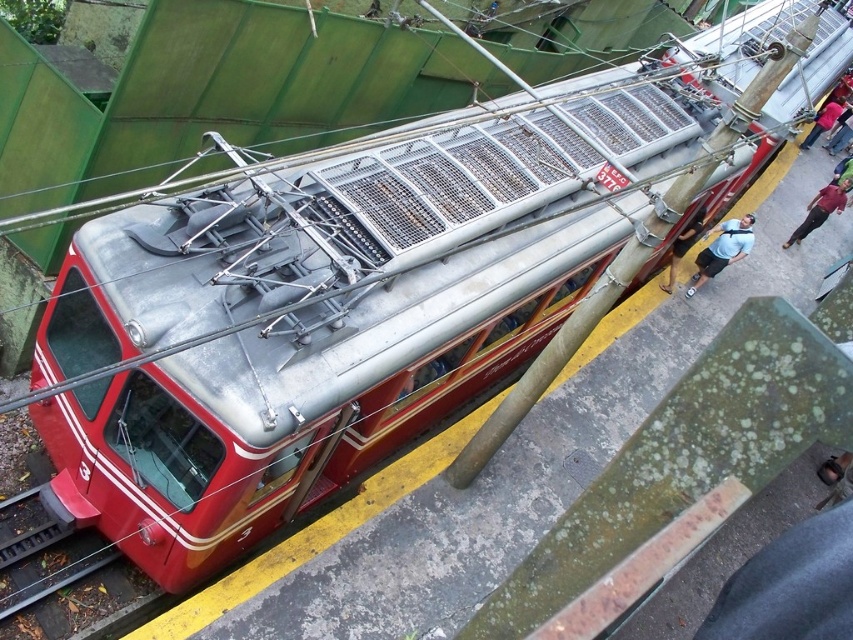
How much distance is there between light blue shirt at center and denim jacket at upper right?

The distance of light blue shirt at center from denim jacket at upper right is 41.24 feet.

Who is taller, light blue shirt at center or denim jacket at upper right?

With more height is denim jacket at upper right.

The height and width of the screenshot is (640, 853). In order to click on light blue shirt at center in this screenshot , I will do `click(722, 250)`.

This screenshot has width=853, height=640. Identify the location of light blue shirt at center. (722, 250).

Can you confirm if dark blue shirt at right is shorter than denim jacket at upper right?

Correct, dark blue shirt at right is not as tall as denim jacket at upper right.

Between dark blue shirt at right and denim jacket at upper right, which one appears on the right side from the viewer's perspective?

Positioned to the right is denim jacket at upper right.

This screenshot has width=853, height=640. Describe the element at coordinates (824, 120) in the screenshot. I see `dark blue shirt at right` at that location.

Where is `dark blue shirt at right`? The image size is (853, 640). dark blue shirt at right is located at coordinates (824, 120).

Is maroon fabric pants at right smaller than denim jacket at upper right?

No.

In the scene shown: Which of these two, maroon fabric pants at right or denim jacket at upper right, stands taller?

With more height is maroon fabric pants at right.

Is point (843, 188) closer to viewer compared to point (833, 138)?

Yes, point (843, 188) is in front of point (833, 138).

Find the location of `maroon fabric pants at right`. maroon fabric pants at right is located at coordinates tap(820, 209).